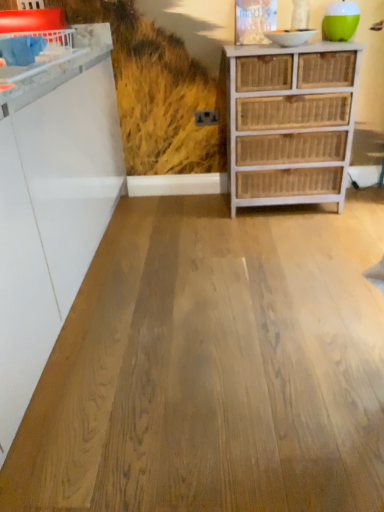
At what (x,y) coordinates should I click in order to perform the action: click on vacant area that is in front of white wicker chest of drawers at right. Please return your answer as a coordinate pair (x, y). Looking at the image, I should click on (292, 241).